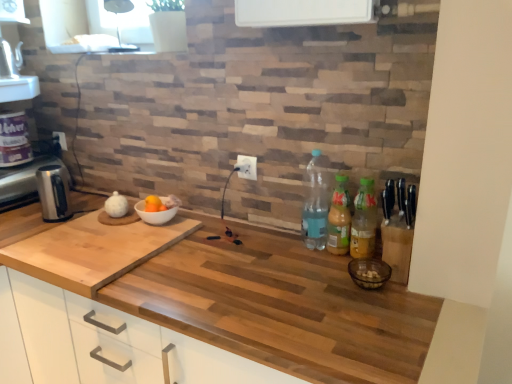
The image size is (512, 384). Find the location of `vacant space behind translucent plastic bottle at right, which ranks as the 1th bottle in left-to-right order`. vacant space behind translucent plastic bottle at right, which ranks as the 1th bottle in left-to-right order is located at coordinates (300, 237).